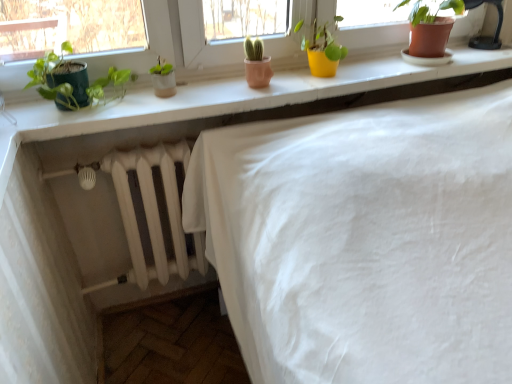
Locate an element on the screen. This screenshot has height=384, width=512. free space between yellow matte pot at upper center, which is the second houseplant in right-to-left order, and terracotta clay pot at upper right, which is the first houseplant in right-to-left order is located at coordinates (367, 70).